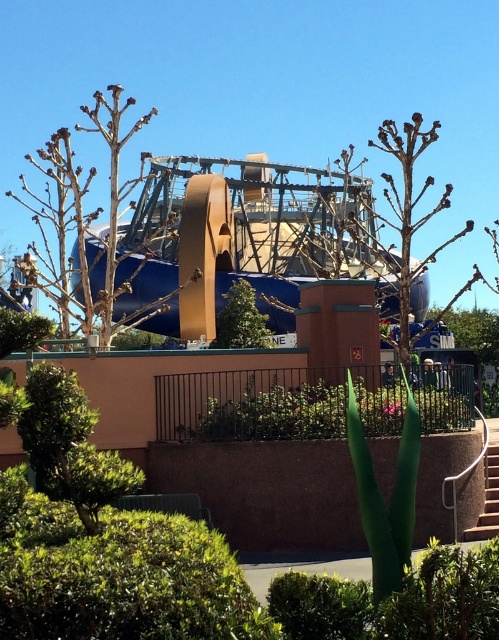
Locate an element on the screen. This screenshot has height=640, width=499. green leafy hedge at center is located at coordinates (276, 413).

Who is positioned more to the right, green leafy hedge at center or green leafy tree at center?

green leafy hedge at center

Does point (216, 404) come closer to viewer compared to point (234, 336)?

Yes, point (216, 404) is closer to viewer.

Where is `green leafy hedge at center`? This screenshot has height=640, width=499. green leafy hedge at center is located at coordinates (276, 413).

Is green leafy hedge at center positioned at the back of white concrete stairs at lower right?

Yes.

Is green leafy hedge at center positioned before white concrete stairs at lower right?

No, green leafy hedge at center is behind white concrete stairs at lower right.

From the picture: Who is more distant from viewer, [245,440] or [489,456]?

Positioned behind is point [489,456].

Where is `green leafy hedge at center`? This screenshot has height=640, width=499. green leafy hedge at center is located at coordinates coord(276,413).

Which is behind, point (227, 337) or point (463, 540)?

The point (227, 337) is more distant.

Does point (261, 326) come closer to viewer compared to point (495, 467)?

No, it is behind (495, 467).

You are a GUI agent. You are given a task and a screenshot of the screen. Output one action in this format:
    pyautogui.click(x=<x>, y=<y>)
    Task: Click on the green leafy tree at center
    Image resolution: width=499 pixels, height=640 pixels.
    Given the screenshot: What is the action you would take?
    pyautogui.click(x=241, y=320)